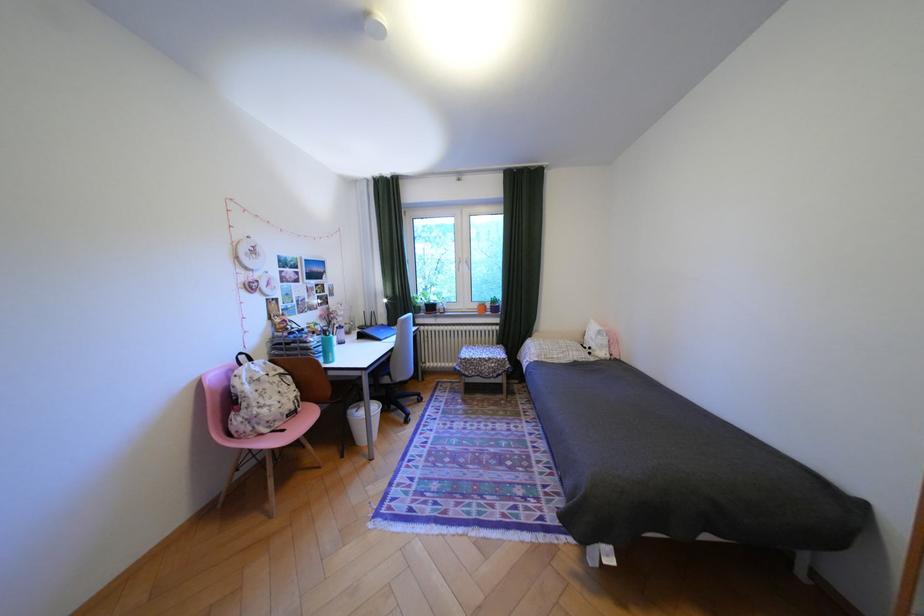
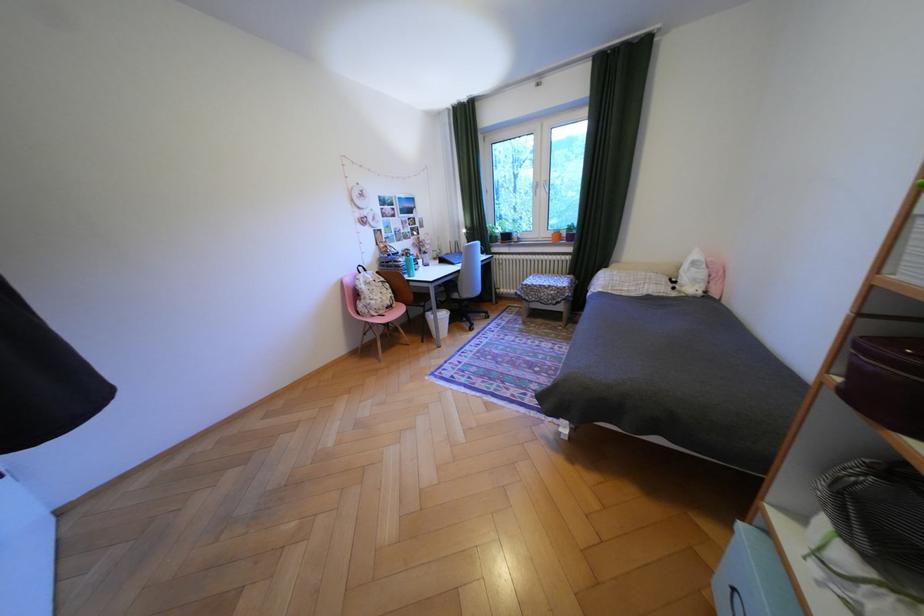
Find the pixel in the second image that matches (x=621, y=357) in the first image.

(712, 293)